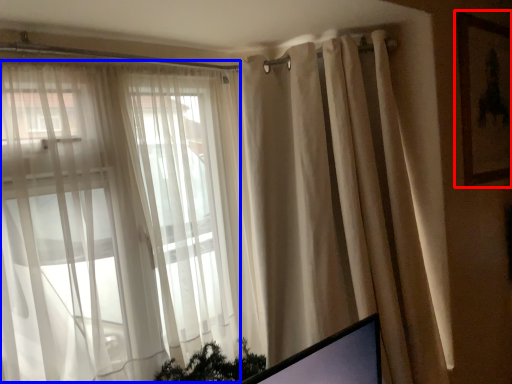
Question: Which object is closer to the camera taking this photo, picture frame (highlighted by a red box) or bay window (highlighted by a blue box)?

Choices:
 (A) picture frame
 (B) bay window

Answer: (B)